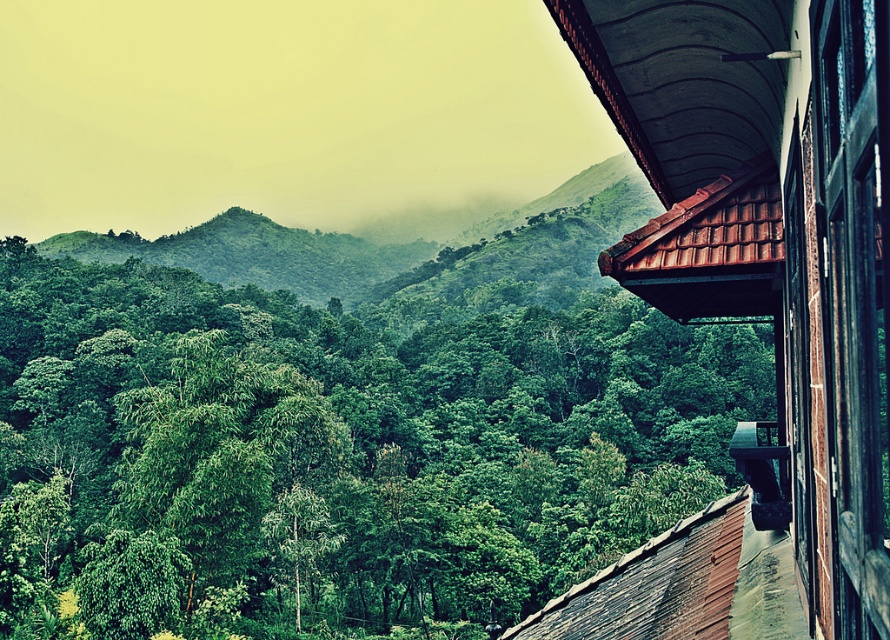
Consider the image. Who is positioned more to the right, green leafy trees at center or black wood window at right?

From the viewer's perspective, black wood window at right appears more on the right side.

Where is `green leafy trees at center`? This screenshot has height=640, width=890. green leafy trees at center is located at coordinates (353, 442).